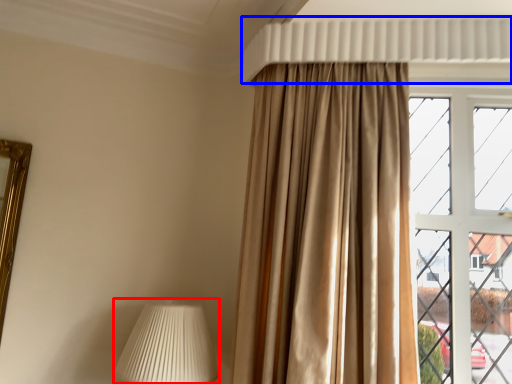
Question: Among these objects, which one is nearest to the camera, table lamp (highlighted by a red box) or shutter (highlighted by a blue box)?

Choices:
 (A) table lamp
 (B) shutter

Answer: (A)